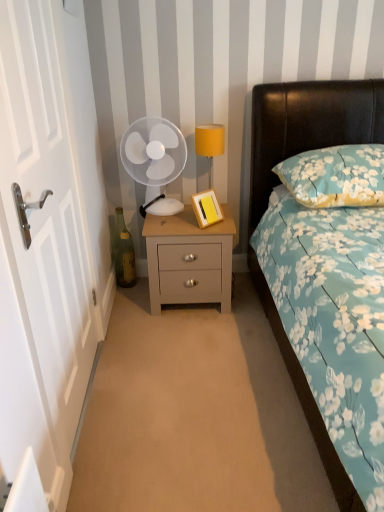
Question: Considering the relative sizes of white wooden door at left and matte gray nightstand at center in the image provided, is white wooden door at left bigger than matte gray nightstand at center?

Choices:
 (A) no
 (B) yes

Answer: (A)

Question: Can you confirm if white wooden door at left is positioned to the right of matte gray nightstand at center?

Choices:
 (A) no
 (B) yes

Answer: (A)

Question: From the image's perspective, does white wooden door at left appear lower than matte gray nightstand at center?

Choices:
 (A) yes
 (B) no

Answer: (B)

Question: Is white wooden door at left not within matte gray nightstand at center?

Choices:
 (A) yes
 (B) no

Answer: (A)

Question: Is white wooden door at left further to the viewer compared to matte gray nightstand at center?

Choices:
 (A) no
 (B) yes

Answer: (A)

Question: Is white plastic mechanical fan at center taller or shorter than white wooden door at left?

Choices:
 (A) short
 (B) tall

Answer: (A)

Question: Is white plastic mechanical fan at center spatially inside white wooden door at left, or outside of it?

Choices:
 (A) outside
 (B) inside

Answer: (A)

Question: Would you say white plastic mechanical fan at center is to the left or to the right of white wooden door at left in the picture?

Choices:
 (A) right
 (B) left

Answer: (A)

Question: Is white plastic mechanical fan at center wider or thinner than white wooden door at left?

Choices:
 (A) wide
 (B) thin

Answer: (A)

Question: Based on their sizes in the image, would you say yellow fabric lampshade at upper right is bigger or smaller than green glass bottle at left?

Choices:
 (A) big
 (B) small

Answer: (A)

Question: From a real-world perspective, is yellow fabric lampshade at upper right physically located above or below green glass bottle at left?

Choices:
 (A) above
 (B) below

Answer: (A)

Question: Is yellow fabric lampshade at upper right spatially inside green glass bottle at left, or outside of it?

Choices:
 (A) inside
 (B) outside

Answer: (B)

Question: Is yellow fabric lampshade at upper right in front of or behind green glass bottle at left in the image?

Choices:
 (A) behind
 (B) front

Answer: (B)

Question: Considering the positions of matte gray nightstand at center and white plastic mechanical fan at center in the image, is matte gray nightstand at center bigger or smaller than white plastic mechanical fan at center?

Choices:
 (A) small
 (B) big

Answer: (B)

Question: Is matte gray nightstand at center spatially inside white plastic mechanical fan at center, or outside of it?

Choices:
 (A) inside
 (B) outside

Answer: (B)